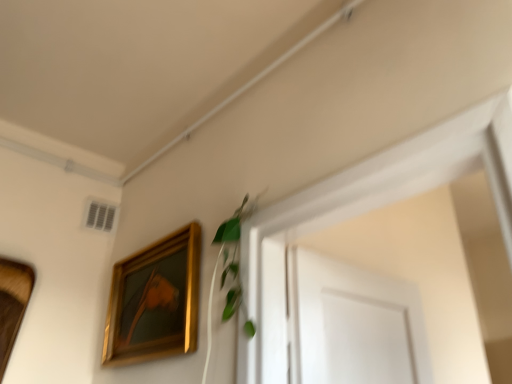
Question: From a real-world perspective, does green leafy plant at upper center stand above wooden picture frame at left, arranged as the 2th picture frame when viewed from the right?

Choices:
 (A) yes
 (B) no

Answer: (A)

Question: Is green leafy plant at upper center closer to camera compared to wooden picture frame at left, the first picture frame viewed from the left?

Choices:
 (A) yes
 (B) no

Answer: (A)

Question: Is green leafy plant at upper center aimed at wooden picture frame at left, the first picture frame viewed from the left?

Choices:
 (A) no
 (B) yes

Answer: (A)

Question: From the image's perspective, is green leafy plant at upper center over wooden picture frame at left, the first picture frame viewed from the left?

Choices:
 (A) yes
 (B) no

Answer: (A)

Question: Considering the relative sizes of green leafy plant at upper center and wooden picture frame at left, the first picture frame viewed from the left, in the image provided, is green leafy plant at upper center shorter than wooden picture frame at left, the first picture frame viewed from the left,?

Choices:
 (A) yes
 (B) no

Answer: (A)

Question: From a real-world perspective, is green leafy plant at upper center physically below wooden picture frame at left, the first picture frame viewed from the left?

Choices:
 (A) no
 (B) yes

Answer: (A)

Question: Are gold/glossy picture frame at upper left, the 2th picture frame positioned from the left, and green leafy plant at upper center beside each other?

Choices:
 (A) no
 (B) yes

Answer: (A)

Question: Considering the relative sizes of gold/glossy picture frame at upper left, the 2th picture frame positioned from the left, and green leafy plant at upper center in the image provided, is gold/glossy picture frame at upper left, the 2th picture frame positioned from the left, bigger than green leafy plant at upper center?

Choices:
 (A) yes
 (B) no

Answer: (A)

Question: Is gold/glossy picture frame at upper left, the 2th picture frame positioned from the left, shorter than green leafy plant at upper center?

Choices:
 (A) no
 (B) yes

Answer: (A)

Question: Is gold/glossy picture frame at upper left, the 2th picture frame positioned from the left, at the left side of green leafy plant at upper center?

Choices:
 (A) no
 (B) yes

Answer: (B)

Question: Is gold/glossy picture frame at upper left, the 2th picture frame positioned from the left, closer to camera compared to green leafy plant at upper center?

Choices:
 (A) yes
 (B) no

Answer: (B)

Question: Would you say gold/glossy picture frame at upper left, the 1th picture frame when ordered from right to left, contains green leafy plant at upper center?

Choices:
 (A) no
 (B) yes

Answer: (A)

Question: Can you confirm if green leafy plant at upper center is positioned to the right of gold/glossy picture frame at upper left, the 2th picture frame positioned from the left?

Choices:
 (A) yes
 (B) no

Answer: (A)